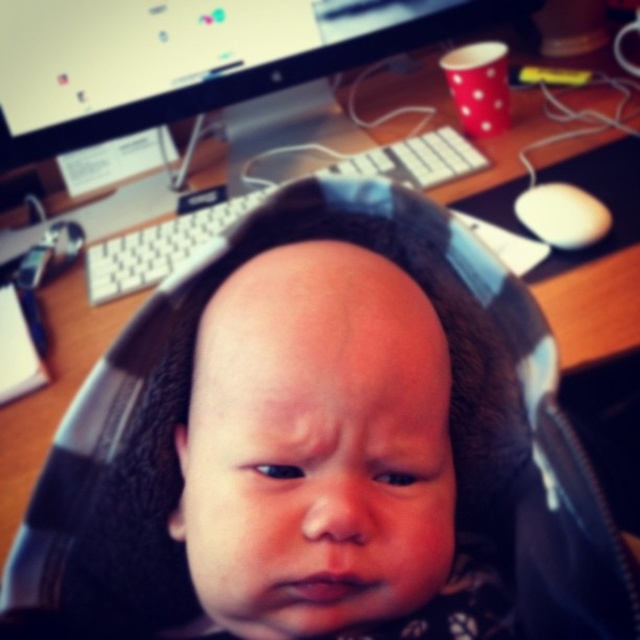
You are holding a ruler and want to measure the distance from your eyes to the point at coordinates point (448, 621) in the image. According to the scene description, what is this distance?

The distance of point (448, 621) from viewer is 15.33 inches.

You are a photographer standing 3 feet away from the smooth skin baby at center. You want to take a picture of the white plastic keyboard at center without moving the baby. Is the keyboard within your reach if you can extend your arm 24 inches? Please explain.

The smooth skin baby at center and white plastic keyboard at center are 22.28 inches apart. Since you are 3 feet away from the baby, the total distance to the keyboard is 3 feet plus 22.28 inches. Converting 3 feet to inches gives 36 inches. Adding 22.28 inches results in 58.28 inches. Your arm can only extend 24 inches, so you cannot reach the keyboard without moving the baby.

Based on the scene description, where is the smooth skin baby at center located in terms of its 2D coordinates?

The smooth skin baby at center is located at the 2D coordinates point (317, 433).